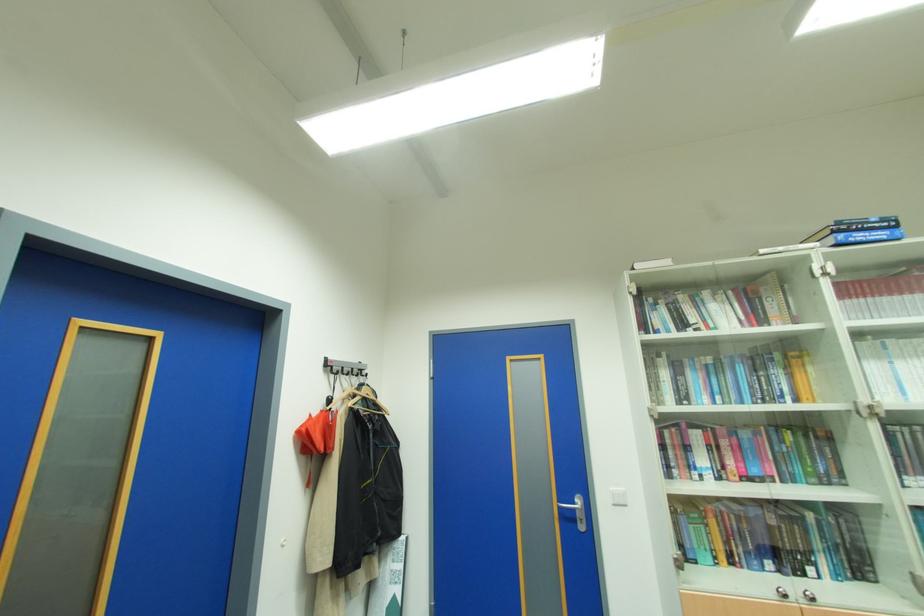
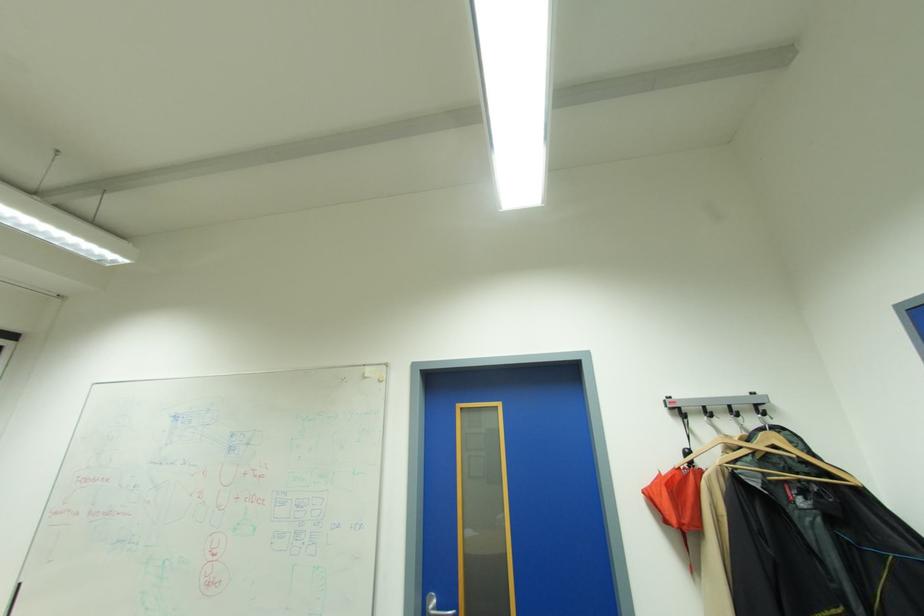
Find the pixel in the second image that matches (x=368, y=387) in the first image.

(764, 434)